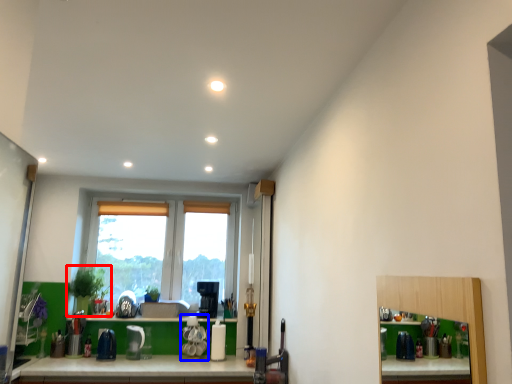
Question: Which of the following is the farthest to the observer, plant (highlighted by a red box) or appliance (highlighted by a blue box)?

Choices:
 (A) plant
 (B) appliance

Answer: (A)